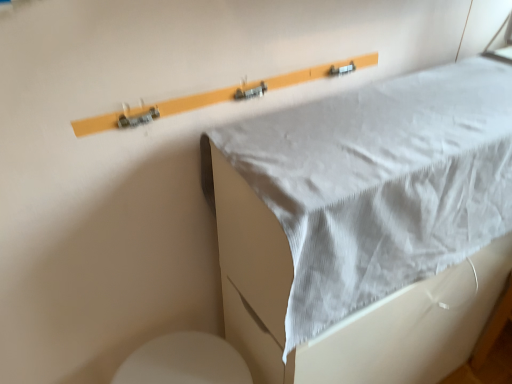
Question: Is white fabric at upper center inside the boundaries of white glossy toilet at lower left, or outside?

Choices:
 (A) inside
 (B) outside

Answer: (B)

Question: From the image's perspective, is white fabric at upper center above or below white glossy toilet at lower left?

Choices:
 (A) below
 (B) above

Answer: (B)

Question: Is white fabric at upper center in front of or behind white glossy toilet at lower left in the image?

Choices:
 (A) behind
 (B) front

Answer: (B)

Question: Which is correct: white glossy toilet at lower left is inside white fabric at upper center, or outside of it?

Choices:
 (A) outside
 (B) inside

Answer: (A)

Question: Is white glossy toilet at lower left wider or thinner than white fabric at upper center?

Choices:
 (A) wide
 (B) thin

Answer: (B)

Question: From a real-world perspective, is white glossy toilet at lower left positioned above or below white fabric at upper center?

Choices:
 (A) above
 (B) below

Answer: (B)

Question: Considering their positions, is white glossy toilet at lower left located in front of or behind white fabric at upper center?

Choices:
 (A) front
 (B) behind

Answer: (B)